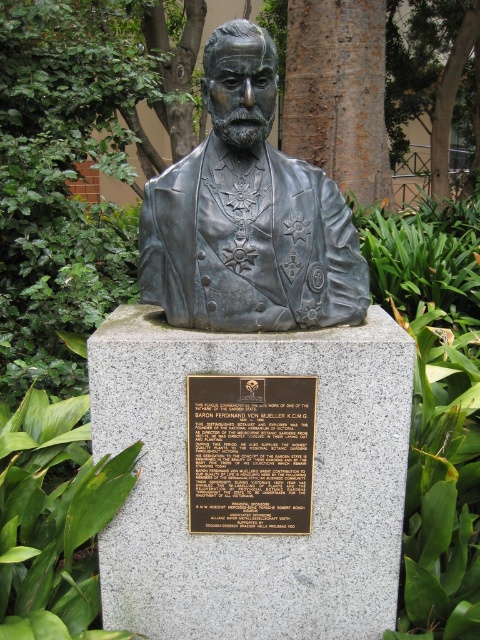
You are a painter standing 5 feet away from the bronze statue at center. You want to paint the brown rough bark tree at center without moving your easel. Is the tree within your painting range if your maximum reach is 15 feet?

The distance between the bronze statue at center and the brown rough bark tree at center is 10.06 feet. Since you are 5 feet away from the bronze statue at center, the total distance to the brown rough bark tree at center would be 5 feet plus 10.06 feet, totaling 15.06 feet. Your maximum reach is 15 feet, so the tree is slightly out of range.

Looking at the scene, where is the bronze bust at center in relation to the green leafy tree at upper center?

The bronze bust at center is to the left of the green leafy tree at upper center.